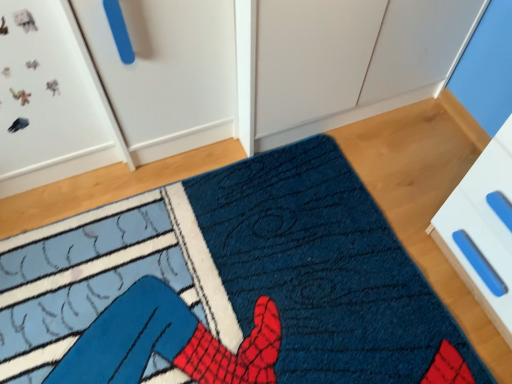
Find the location of a particular element. The width and height of the screenshot is (512, 384). free space that is in between white plastic drawer at lower right and textured blue rug at center is located at coordinates (402, 192).